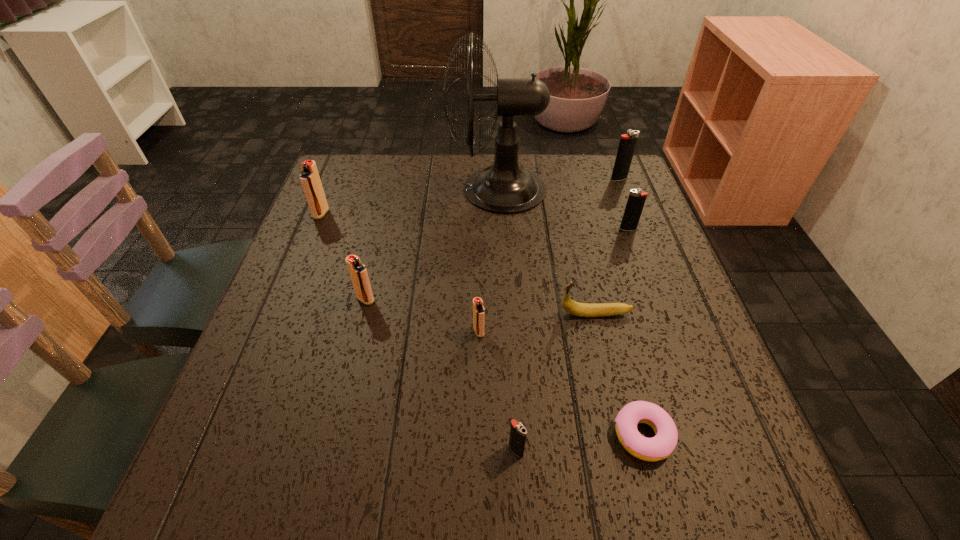
Identify the location of the sixth farthest object. (572, 307).

Locate an element on the screen. The width and height of the screenshot is (960, 540). the third nearest object is located at coordinates (478, 309).

Where is `the smallest red igniter`? This screenshot has height=540, width=960. the smallest red igniter is located at coordinates (478, 309).

Image resolution: width=960 pixels, height=540 pixels. Find the location of `the leftmost black igniter`. the leftmost black igniter is located at coordinates point(518,432).

At what (x,y) coordinates should I click in order to perform the action: click on the nearest black igniter. Please return your answer as a coordinate pair (x, y). Looking at the image, I should click on (518, 432).

You are a GUI agent. You are given a task and a screenshot of the screen. Output one action in this format:
    pyautogui.click(x=<x>, y=<y>)
    Task: Click on the shortest object
    Image resolution: width=960 pixels, height=540 pixels.
    Given the screenshot: What is the action you would take?
    pyautogui.click(x=659, y=447)

In order to click on pink doughnut in this screenshot , I will do `click(659, 447)`.

Where is `vacant region located 0.240m on the front-facing side of the fan`? vacant region located 0.240m on the front-facing side of the fan is located at coordinates (364, 189).

Identify the location of vacant space located on the front-facing side of the fan. (374, 189).

Find the location of a particular element. The width and height of the screenshot is (960, 540). vacant space located 0.180m on the front-facing side of the fan is located at coordinates (385, 189).